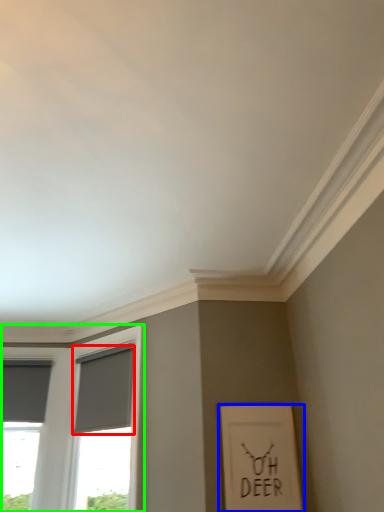
Question: Considering the real-world distances, which object is farthest from curtain (highlighted by a red box)? picture frame (highlighted by a blue box) or window (highlighted by a green box)?

Choices:
 (A) picture frame
 (B) window

Answer: (A)